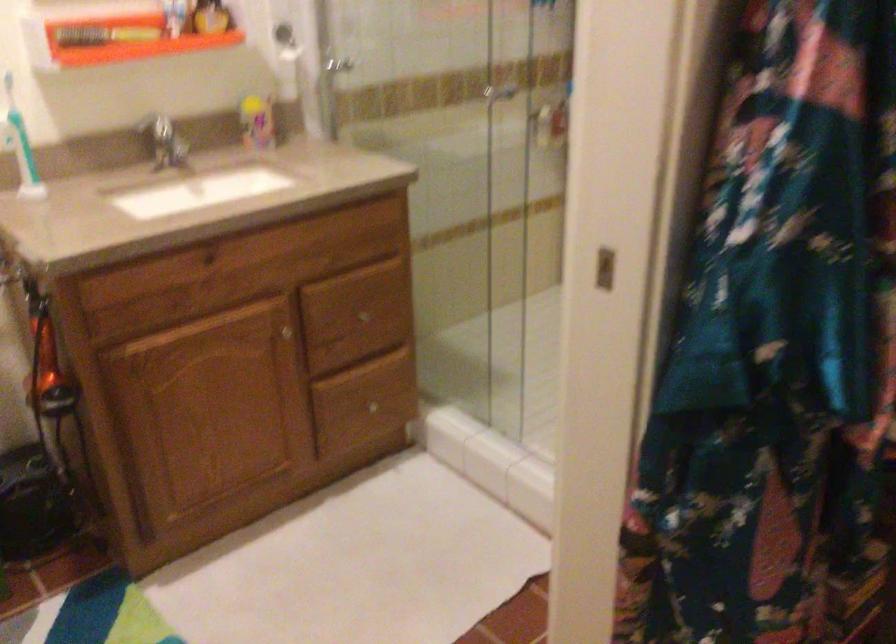
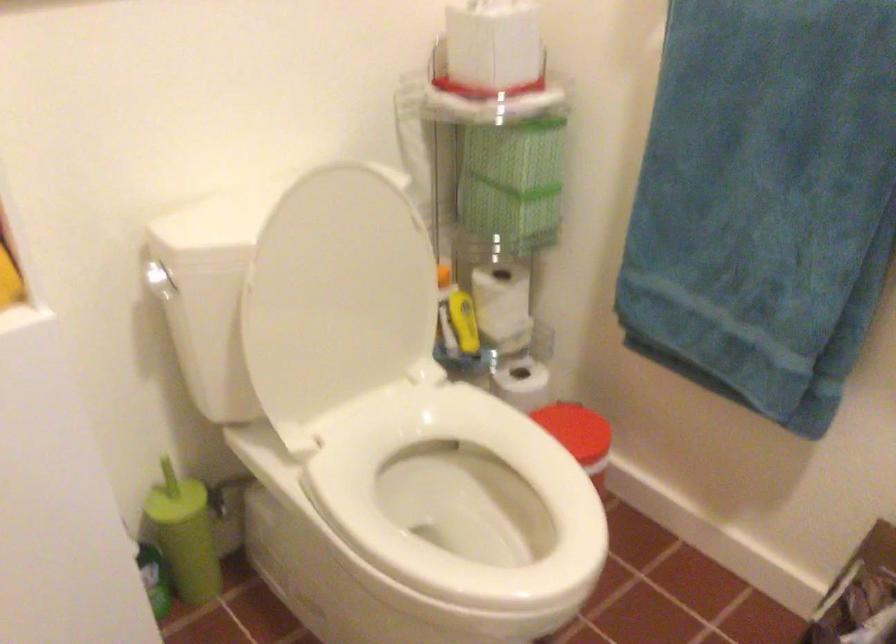
The images are taken continuously from a first-person perspective. In which direction is your viewpoint rotating?

The camera rotated toward left-down.